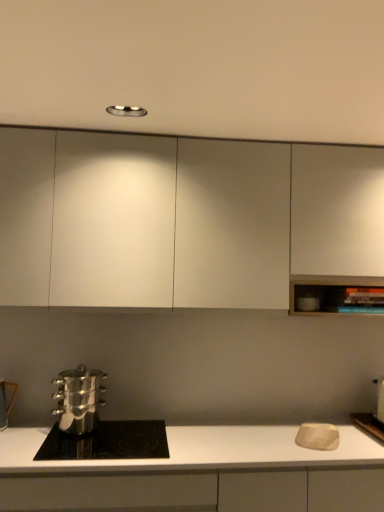
Measure the distance between polished stainless steel steamer at lower left and camera.

polished stainless steel steamer at lower left and camera are 2.06 meters apart from each other.

Consider the image. How much space does white matte countertop at lower center, acting as the first cabinetry starting from the bottom, occupy horizontally?

white matte countertop at lower center, acting as the first cabinetry starting from the bottom, is 23.58 inches in width.

What are the coordinates of `metallic silver pot at lower left, positioned as the first appliance in left-to-right order` in the screenshot? It's located at (6, 402).

This screenshot has height=512, width=384. I want to click on white matte cabinet at upper center, which is the 2th cabinetry in bottom-to-top order, so click(180, 219).

Considering the points (137, 183) and (69, 444), which point is behind, point (137, 183) or point (69, 444)?

The point (137, 183) is behind.

How many degrees apart are the facing directions of white matte cabinet at upper center, which is the 2th cabinetry in bottom-to-top order, and polished stainless steel pot at lower left?

The facing directions of white matte cabinet at upper center, which is the 2th cabinetry in bottom-to-top order, and polished stainless steel pot at lower left are 0.00224 degrees apart.

Is white matte cabinet at upper center, which is the 1th cabinetry in top-to-bottom order, far from polished stainless steel pot at lower left?

Actually, white matte cabinet at upper center, which is the 1th cabinetry in top-to-bottom order, and polished stainless steel pot at lower left are a little close together.

Starting from the polished stainless steel pot at lower left, which cabinetry is the 1st one to the right? Please provide its 2D coordinates.

[(180, 219)]

Is polished stainless steel steamer at lower left facing towards polished stainless steel pot at lower left?

No, polished stainless steel steamer at lower left is not aimed at polished stainless steel pot at lower left.

Considering the sizes of objects polished stainless steel steamer at lower left and polished stainless steel pot at lower left in the image provided, who is bigger, polished stainless steel steamer at lower left or polished stainless steel pot at lower left?

polished stainless steel steamer at lower left.

Does polished stainless steel steamer at lower left come in front of polished stainless steel pot at lower left?

No, polished stainless steel steamer at lower left is behind polished stainless steel pot at lower left.

From the picture: From the image's perspective, is polished stainless steel steamer at lower left beneath polished stainless steel pot at lower left?

No, from the image's perspective, polished stainless steel steamer at lower left is not below polished stainless steel pot at lower left.

Is polished stainless steel steamer at lower left shorter than white matte cabinet at upper center, which is the 2th cabinetry in bottom-to-top order?

Yes, polished stainless steel steamer at lower left is shorter than white matte cabinet at upper center, which is the 2th cabinetry in bottom-to-top order.

In the image, is polished stainless steel steamer at lower left positioned in front of or behind white matte cabinet at upper center, which is the 2th cabinetry in bottom-to-top order?

Visually, polished stainless steel steamer at lower left is located behind white matte cabinet at upper center, which is the 2th cabinetry in bottom-to-top order.

Could you tell me if polished stainless steel steamer at lower left is turned towards white matte cabinet at upper center, which is the 2th cabinetry in bottom-to-top order?

No, polished stainless steel steamer at lower left is not oriented towards white matte cabinet at upper center, which is the 2th cabinetry in bottom-to-top order.

Consider the image. Is polished stainless steel steamer at lower left touching white matte cabinet at upper center, which is the 2th cabinetry in bottom-to-top order?

No, polished stainless steel steamer at lower left is not in contact with white matte cabinet at upper center, which is the 2th cabinetry in bottom-to-top order.

Which object is thinner, polished stainless steel pot at lower left or matte white cutting board at right, the 2th appliance from the left?

With smaller width is matte white cutting board at right, the 2th appliance from the left.

Can you confirm if polished stainless steel pot at lower left is positioned to the left of matte white cutting board at right, the 2th appliance from the left?

Indeed, polished stainless steel pot at lower left is positioned on the left side of matte white cutting board at right, the 2th appliance from the left.

Can you see polished stainless steel pot at lower left touching matte white cutting board at right, the 2th appliance from the left?

polished stainless steel pot at lower left and matte white cutting board at right, the 2th appliance from the left, are clearly separated.

Is point (92, 441) less distant than point (379, 397)?

Yes, point (92, 441) is in front of point (379, 397).

Is the depth of polished stainless steel pot at lower left less than that of white matte cabinet at upper center, which is the 2th cabinetry in bottom-to-top order?

Yes, polished stainless steel pot at lower left is closer to the viewer.

Would you consider polished stainless steel pot at lower left to be distant from white matte cabinet at upper center, which is the 1th cabinetry in top-to-bottom order?

polished stainless steel pot at lower left is near white matte cabinet at upper center, which is the 1th cabinetry in top-to-bottom order, not far away.

In terms of height, does polished stainless steel pot at lower left look taller or shorter compared to white matte cabinet at upper center, which is the 1th cabinetry in top-to-bottom order?

polished stainless steel pot at lower left is shorter than white matte cabinet at upper center, which is the 1th cabinetry in top-to-bottom order.

From the image's perspective, does polished stainless steel pot at lower left appear higher than white matte cabinet at upper center, which is the 1th cabinetry in top-to-bottom order?

No, from the image's perspective, polished stainless steel pot at lower left is not above white matte cabinet at upper center, which is the 1th cabinetry in top-to-bottom order.

Measure the distance from matte white cutting board at right, the 2th appliance from the left, to white matte cabinet at upper center, which is the 2th cabinetry in bottom-to-top order.

The distance of matte white cutting board at right, the 2th appliance from the left, from white matte cabinet at upper center, which is the 2th cabinetry in bottom-to-top order, is 4.94 feet.

Which is in front, matte white cutting board at right, the 2th appliance from the left, or white matte cabinet at upper center, which is the 2th cabinetry in bottom-to-top order?

Positioned in front is white matte cabinet at upper center, which is the 2th cabinetry in bottom-to-top order.

Image resolution: width=384 pixels, height=512 pixels. What are the coordinates of `cabinetry above the matte white cutting board at right, the 2th appliance from the left (from a real-world perspective)` in the screenshot? It's located at (180, 219).

Is matte white cutting board at right, the 2th appliance from the left, facing away from white matte cabinet at upper center, which is the 1th cabinetry in top-to-bottom order?

No, white matte cabinet at upper center, which is the 1th cabinetry in top-to-bottom order, is not at the back of matte white cutting board at right, the 2th appliance from the left.

From a real-world perspective, who is located higher, white matte cabinet at upper center, which is the 1th cabinetry in top-to-bottom order, or metallic silver pot at lower left, positioned as the first appliance in left-to-right order?

white matte cabinet at upper center, which is the 1th cabinetry in top-to-bottom order.

Is white matte cabinet at upper center, which is the 1th cabinetry in top-to-bottom order, thinner than metallic silver pot at lower left, which is the second appliance from right to left?

In fact, white matte cabinet at upper center, which is the 1th cabinetry in top-to-bottom order, might be wider than metallic silver pot at lower left, which is the second appliance from right to left.

Identify the location of the 1st cabinetry counting from the right of the metallic silver pot at lower left, positioned as the first appliance in left-to-right order. (180, 219).

From the image's perspective, is white matte cabinet at upper center, which is the 2th cabinetry in bottom-to-top order, located above metallic silver pot at lower left, which is the second appliance from right to left?

Yes.

In order to click on cabinetry that appears behind the polished stainless steel pot at lower left in this screenshot , I will do `click(180, 219)`.

You are a GUI agent. You are given a task and a screenshot of the screen. Output one action in this format:
    pyautogui.click(x=<x>, y=<y>)
    Task: Click on the kitchen appliance above the polished stainless steel pot at lower left (from a real-world perspective)
    
    Given the screenshot: What is the action you would take?
    pyautogui.click(x=78, y=399)

Which object lies nearer to the anchor point polished stainless steel pot at lower left, polished stainless steel steamer at lower left or white matte countertop at lower center, placed as the 2th cabinetry when sorted from top to bottom?

Among the two, polished stainless steel steamer at lower left is located nearer to polished stainless steel pot at lower left.

Which object lies nearer to the anchor point polished stainless steel pot at lower left, polished stainless steel steamer at lower left or white matte cabinet at upper center, which is the 1th cabinetry in top-to-bottom order?

polished stainless steel steamer at lower left lies closer to polished stainless steel pot at lower left than the other object.

When comparing their distances from metallic silver pot at lower left, positioned as the first appliance in left-to-right order, does polished stainless steel pot at lower left or matte white cutting board at right, positioned as the 1th appliance in right-to-left order, seem closer?

polished stainless steel pot at lower left is positioned closer to the anchor metallic silver pot at lower left, positioned as the first appliance in left-to-right order.

Which object lies nearer to the anchor point white matte countertop at lower center, placed as the 2th cabinetry when sorted from top to bottom, matte white cutting board at right, positioned as the 1th appliance in right-to-left order, or metallic silver pot at lower left, positioned as the first appliance in left-to-right order?

metallic silver pot at lower left, positioned as the first appliance in left-to-right order, is positioned closer to the anchor white matte countertop at lower center, placed as the 2th cabinetry when sorted from top to bottom.

From the image, which object appears to be farther from white matte countertop at lower center, placed as the 2th cabinetry when sorted from top to bottom, polished stainless steel steamer at lower left or polished stainless steel pot at lower left?

The object further to white matte countertop at lower center, placed as the 2th cabinetry when sorted from top to bottom, is polished stainless steel steamer at lower left.

Based on their spatial positions, is metallic silver pot at lower left, which is the second appliance from right to left, or white matte cabinet at upper center, which is the 2th cabinetry in bottom-to-top order, further from white matte countertop at lower center, acting as the first cabinetry starting from the bottom?

→ Among the two, white matte cabinet at upper center, which is the 2th cabinetry in bottom-to-top order, is located further to white matte countertop at lower center, acting as the first cabinetry starting from the bottom.

Which object lies further to the anchor point white matte cabinet at upper center, which is the 1th cabinetry in top-to-bottom order, matte white cutting board at right, the 2th appliance from the left, or polished stainless steel steamer at lower left?

matte white cutting board at right, the 2th appliance from the left, lies further to white matte cabinet at upper center, which is the 1th cabinetry in top-to-bottom order, than the other object.

Which object lies nearer to the anchor point metallic silver pot at lower left, positioned as the first appliance in left-to-right order, white matte cabinet at upper center, which is the 1th cabinetry in top-to-bottom order, or polished stainless steel pot at lower left?

polished stainless steel pot at lower left is positioned closer to the anchor metallic silver pot at lower left, positioned as the first appliance in left-to-right order.

Locate an element on the screen. The image size is (384, 512). kitchen appliance between metallic silver pot at lower left, which is the second appliance from right to left, and matte white cutting board at right, the 2th appliance from the left, from left to right is located at coordinates (78, 399).

I want to click on home appliance between metallic silver pot at lower left, positioned as the first appliance in left-to-right order, and matte white cutting board at right, positioned as the 1th appliance in right-to-left order, so click(108, 442).

The width and height of the screenshot is (384, 512). I want to click on home appliance between polished stainless steel steamer at lower left and matte white cutting board at right, positioned as the 1th appliance in right-to-left order, so click(108, 442).

Locate an element on the screen. Image resolution: width=384 pixels, height=512 pixels. kitchen appliance between white matte cabinet at upper center, which is the 2th cabinetry in bottom-to-top order, and white matte countertop at lower center, acting as the first cabinetry starting from the bottom, in the vertical direction is located at coordinates (78, 399).